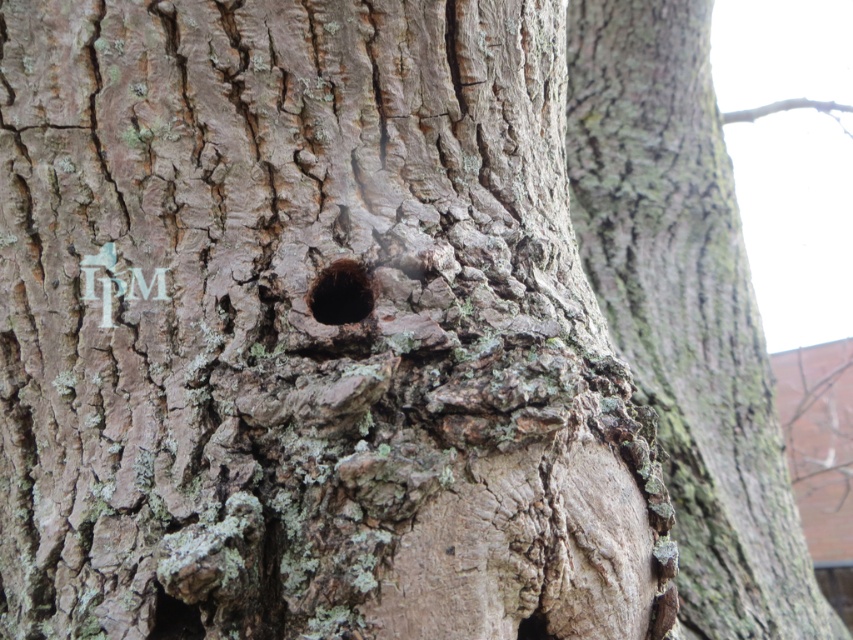
Describe the element at coordinates (685, 308) in the screenshot. I see `smooth gray bark at center` at that location.

Can you confirm if smooth gray bark at center is positioned above black rough hole at center?

Indeed, smooth gray bark at center is positioned over black rough hole at center.

Between point (666, 465) and point (352, 278), which one is positioned behind?

Point (666, 465)

The width and height of the screenshot is (853, 640). I want to click on smooth gray bark at center, so click(685, 308).

Can you confirm if smooth gray bark at center is positioned to the right of dark brown rough bark hole at lower left?

Correct, you'll find smooth gray bark at center to the right of dark brown rough bark hole at lower left.

Is smooth gray bark at center smaller than dark brown rough bark hole at lower left?

No.

The width and height of the screenshot is (853, 640). Identify the location of smooth gray bark at center. (685, 308).

At what (x,y) coordinates should I click in order to perform the action: click on smooth gray bark at center. Please return your answer as a coordinate pair (x, y). Looking at the image, I should click on (685, 308).

Can you confirm if black rough hole at center is positioned below dark brown rough bark hole at lower left?

No, black rough hole at center is not below dark brown rough bark hole at lower left.

Measure the distance between black rough hole at center and dark brown rough bark hole at lower left.

black rough hole at center is 9.69 inches from dark brown rough bark hole at lower left.

I want to click on black rough hole at center, so click(340, 292).